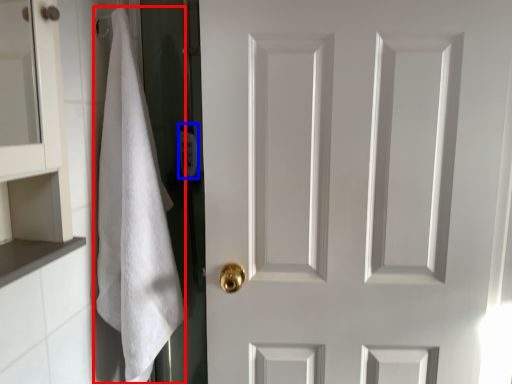
Question: Which object appears closest to the camera in this image, bath towel (highlighted by a red box) or toiletry (highlighted by a blue box)?

Choices:
 (A) bath towel
 (B) toiletry

Answer: (A)